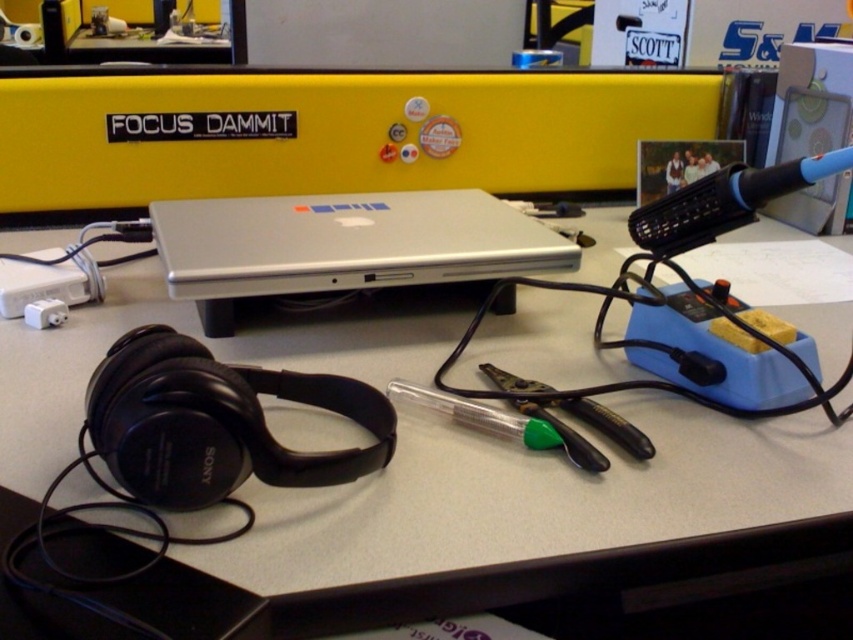
You are looking at the workspace setup on the desk. There are two points marked on the image, point 1 at coordinates point (x=798, y=308) and point 2 at coordinates point (x=515, y=269). Which point is closer to you?

Point (x=798, y=308) is closer to you because it is further to the viewer than point (x=515, y=269).

You are organizing your workspace and need to place a new item on the white plastic computer desk at center. Based on the current setup, where should you place it to avoid blocking the laptop?

The white plastic computer desk at center has the laptop placed centrally on it. To avoid blocking the laptop, place the new item either to the left or right side of the desk, away from the central area where the laptop is positioned.